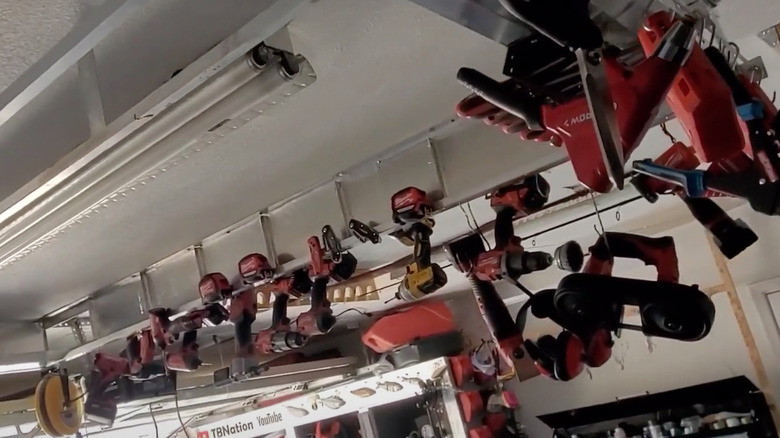
The height and width of the screenshot is (438, 780). Find the location of `storage rack`. storage rack is located at coordinates (356, 289).